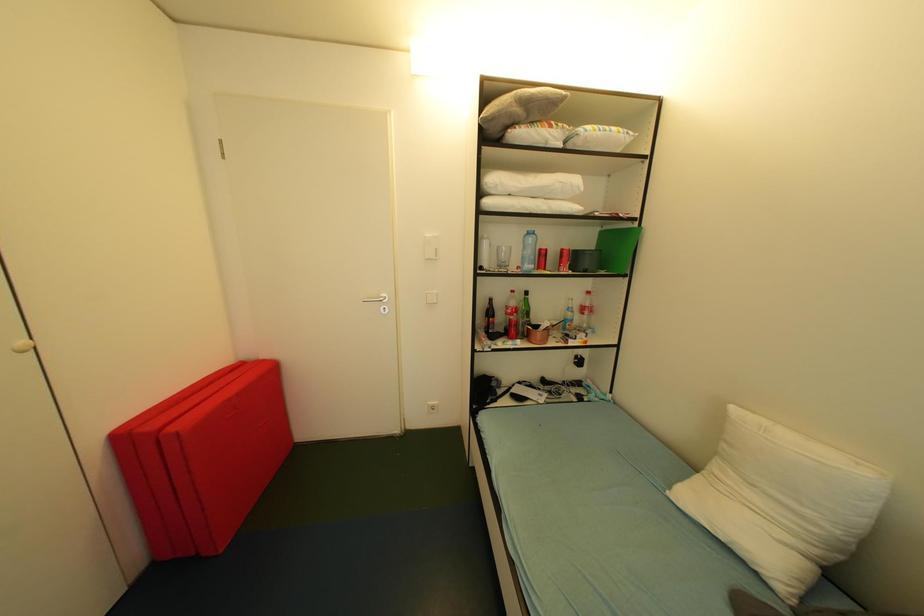
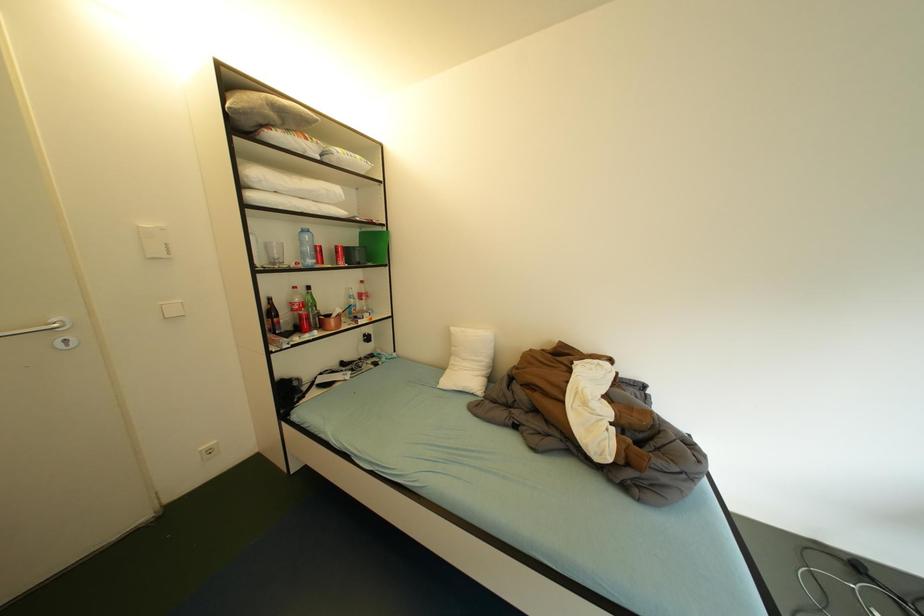
Question: Based on the continuous images, in which direction is the camera rotating? Reply with the corresponding letter.

Choices:
 (A) Left
 (B) Right
 (C) Up
 (D) Down

Answer: (B)